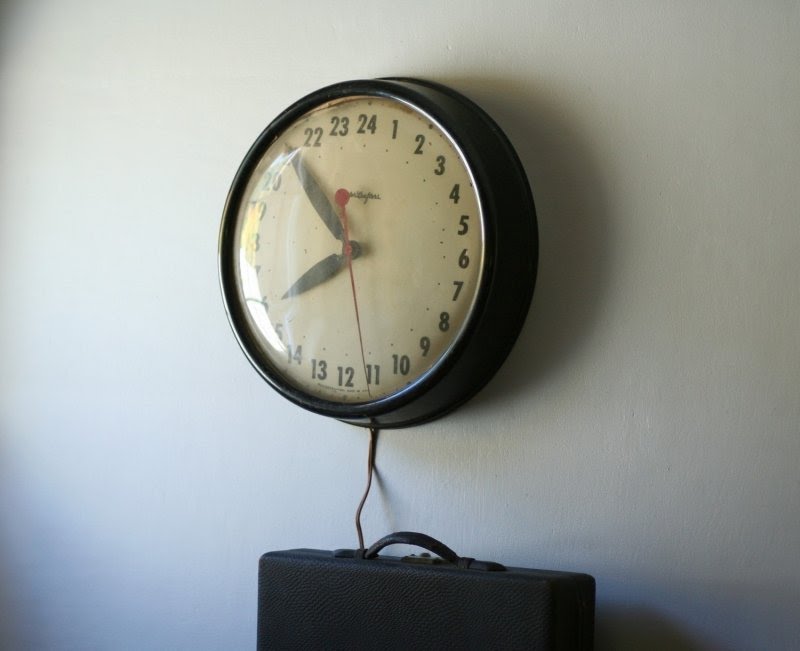
Where is `wall`? This screenshot has width=800, height=651. wall is located at coordinates (153, 265).